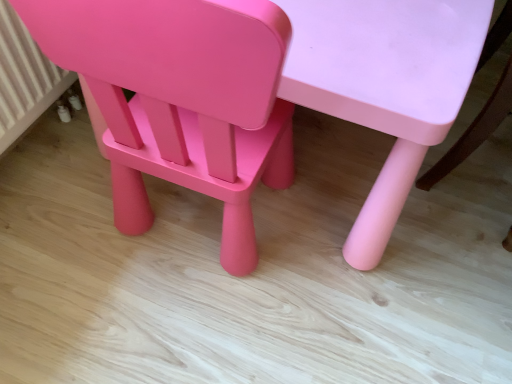
Where is `vacant area that lies in front of matte plastic chair at center`? The image size is (512, 384). vacant area that lies in front of matte plastic chair at center is located at coordinates (184, 321).